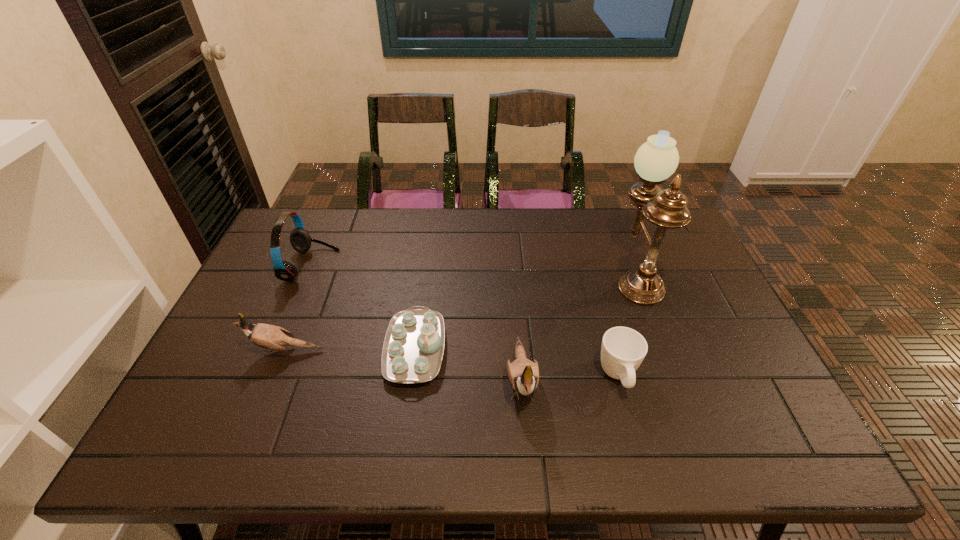
Where is `the left bird`? The image size is (960, 540). the left bird is located at coordinates (266, 336).

Locate an element on the screen. the shorter bird is located at coordinates (266, 336).

This screenshot has width=960, height=540. I want to click on the third object from right to left, so click(523, 375).

Identify the location of the taller bird. (523, 375).

This screenshot has width=960, height=540. Identify the location of headset. (300, 239).

Where is `the tallest object`? the tallest object is located at coordinates (657, 159).

Image resolution: width=960 pixels, height=540 pixels. Identify the location of oil lamp. (657, 159).

I want to click on the fourth object from right to left, so click(413, 348).

Where is `cup`? The height and width of the screenshot is (540, 960). cup is located at coordinates (623, 349).

The image size is (960, 540). Find the location of `free location located 0.050m at the face of the shorter bird`. free location located 0.050m at the face of the shorter bird is located at coordinates (228, 350).